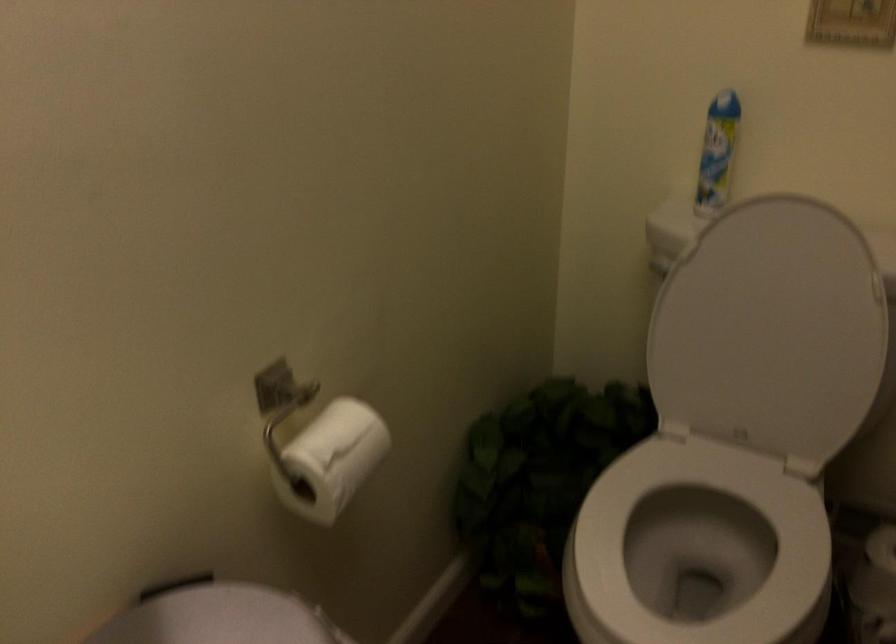
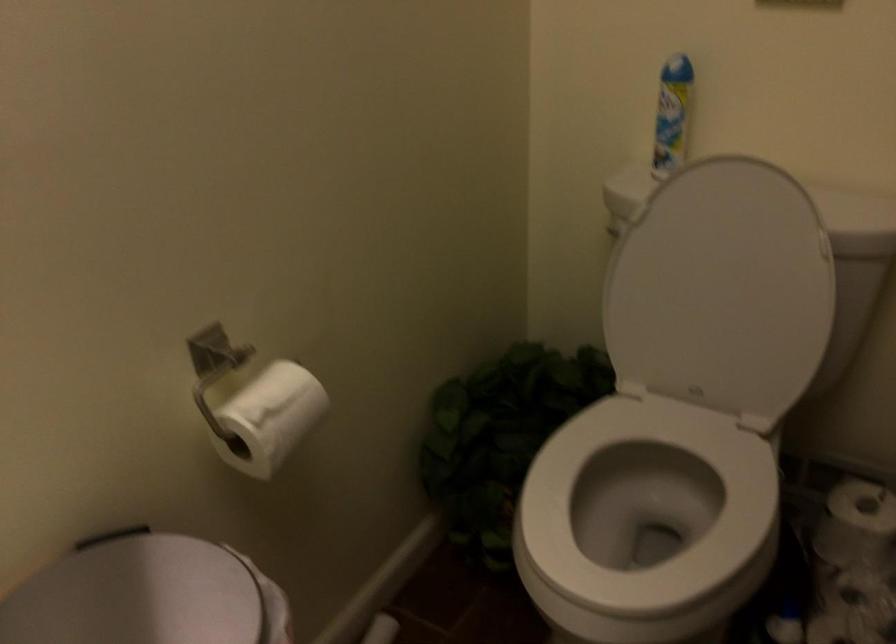
In the second image, find the point that corresponds to [769,330] in the first image.

(721, 289)